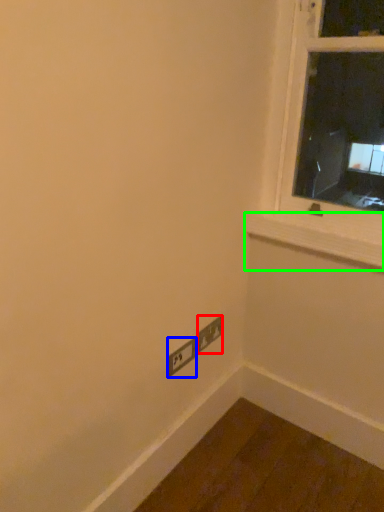
Question: Considering the real-world distances, which object is closest to power plugs and sockets (highlighted by a red box)? power plugs and sockets (highlighted by a blue box) or window sill (highlighted by a green box).

Choices:
 (A) power plugs and sockets
 (B) window sill

Answer: (A)